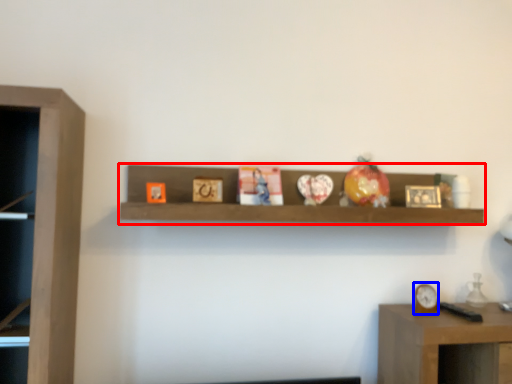
Question: Which object is closer to the camera taking this photo, shelf (highlighted by a red box) or clock (highlighted by a blue box)?

Choices:
 (A) shelf
 (B) clock

Answer: (A)